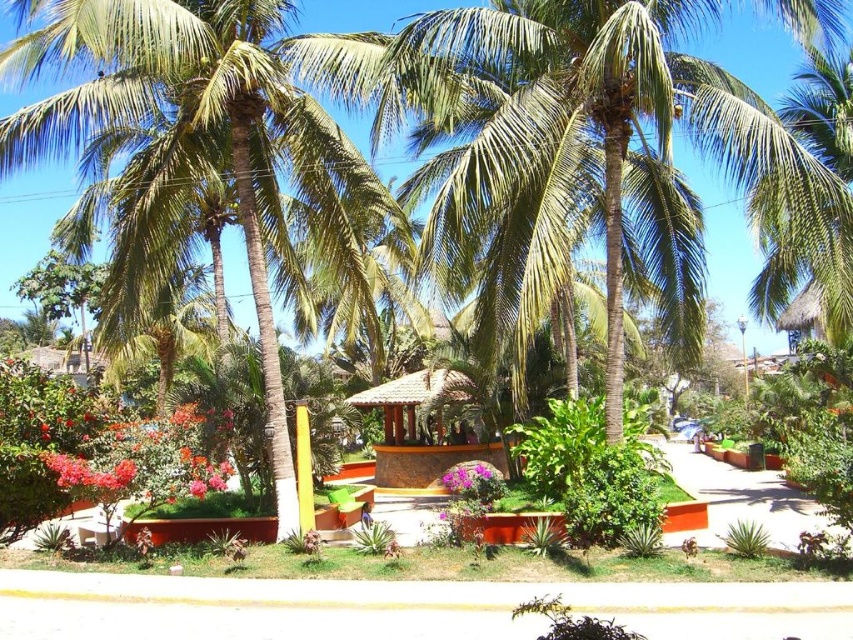
Question: Which point is farther to the camera?

Choices:
 (A) purple matte flower at center
 (B) brown thatched hut at center
 (C) vivid red petals at lower left
 (D) green leafy coconut tree at center

Answer: (B)

Question: Does vivid red petals at lower left appear on the left side of pink matte flower at center?

Choices:
 (A) no
 (B) yes

Answer: (B)

Question: Considering the real-world distances, which object is farthest from the bright red petals at lower left?

Choices:
 (A) brown thatched hut at center
 (B) green leafy coconut tree at center
 (C) vivid red petals at lower left
 (D) purple matte flower at center

Answer: (A)

Question: Which object appears farthest from the camera in this image?

Choices:
 (A) purple matte flower at center
 (B) brown thatched hut at center
 (C) vivid red petals at lower left

Answer: (B)

Question: Observing the image, what is the correct spatial positioning of vivid red petals at lower left in reference to bright red petals at lower left?

Choices:
 (A) below
 (B) above

Answer: (A)

Question: Is bright red petals at lower left below purple matte flower at center?

Choices:
 (A) yes
 (B) no

Answer: (B)